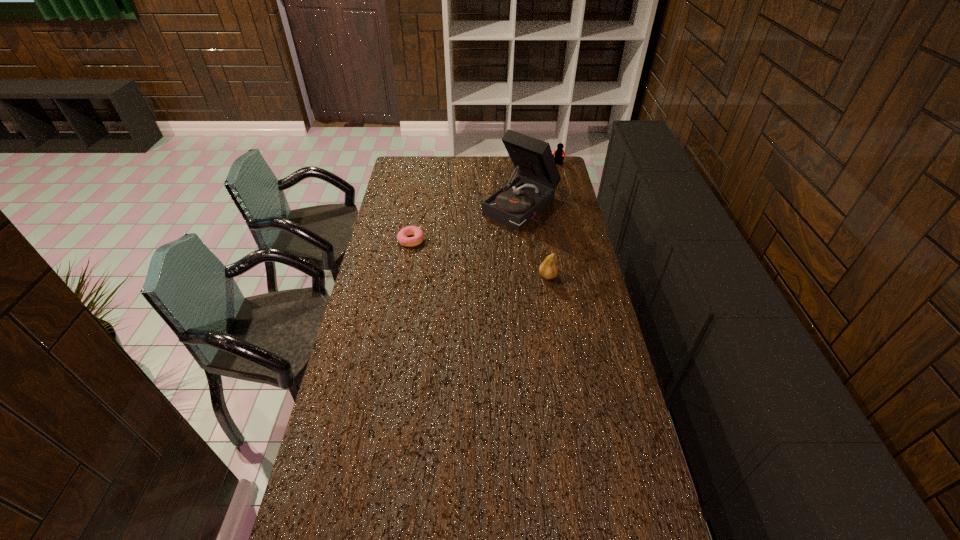
In order to click on vacant space situated on the front-facing side of the phonograph_record in this screenshot , I will do `click(475, 245)`.

The height and width of the screenshot is (540, 960). Find the location of `free space located on the front-facing side of the farthest object`. free space located on the front-facing side of the farthest object is located at coordinates (531, 190).

You are a GUI agent. You are given a task and a screenshot of the screen. Output one action in this format:
    pyautogui.click(x=<x>, y=<y>)
    Task: Click on the vacant space located 0.070m on the front-facing side of the farthest object
    This screenshot has width=960, height=540.
    Given the screenshot: What is the action you would take?
    pyautogui.click(x=548, y=172)

Locate an element on the screen. The image size is (960, 540). vacant space situated on the front-facing side of the farthest object is located at coordinates (542, 178).

Identify the location of object present at the far edge. Image resolution: width=960 pixels, height=540 pixels. (559, 153).

Locate an element on the screen. The image size is (960, 540). object at the left edge is located at coordinates (402, 238).

Find the location of a particular element. This screenshot has height=540, width=960. pear that is at the right edge is located at coordinates (548, 269).

Locate an element on the screen. This screenshot has height=540, width=960. phonograph_record at the right edge is located at coordinates (518, 202).

Locate an element on the screen. The width and height of the screenshot is (960, 540). Lego at the right edge is located at coordinates (559, 153).

Locate an element on the screen. object situated at the far right corner is located at coordinates (559, 153).